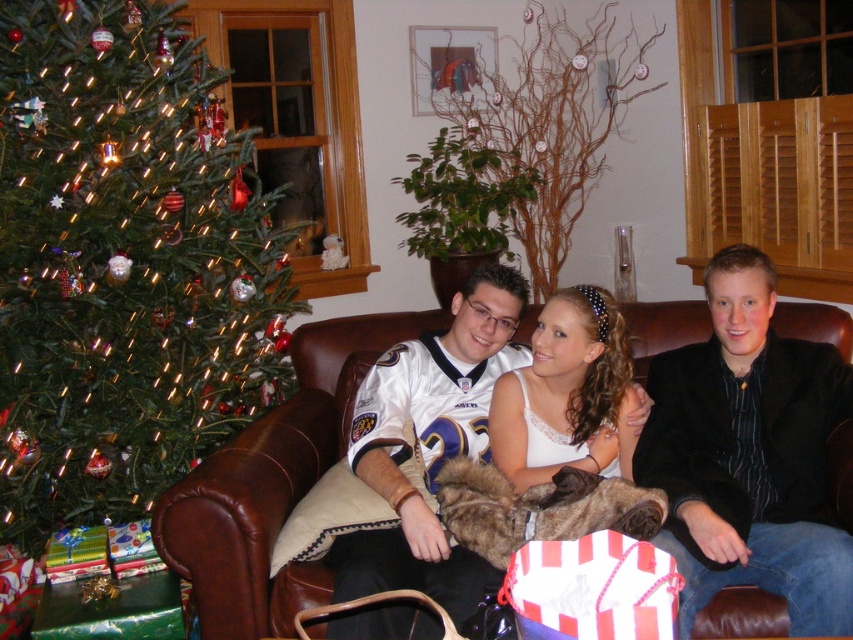
You are a photographer taking a picture of the black smooth jacket at center and the white jersey at center. Which one is positioned higher in the image?

The black smooth jacket at center is located above the white jersey at center, so it is positioned higher in the image.

You are a delivery person holding a package that requires a 60 cm clearance to maneuver safely. You need to move from the green matte christmas tree at left to the brown leather couch at center. Can you navigate this path safely with the package?

The distance between the green matte christmas tree at left and brown leather couch at center is 53.19 centimeters. Since the required clearance is 60 cm, the package cannot be safely maneuvered through this path as the available space is insufficient.

You are standing in the living room and want to place a gift box on the black smooth jacket at center. The gift box has a height of 15 cm. What is the maximum height the gift box can be without exceeding the jacket?

The black smooth jacket at center has a height of 15 cm, so the gift box can be placed on it without exceeding the jacket.